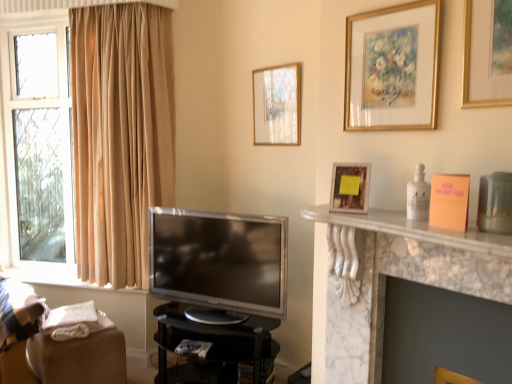
Locate an element on the screen. The image size is (512, 384). gold-framed painting at upper center, positioned as the third picture frame in back-to-front order is located at coordinates (392, 68).

In order to face satin silver television at center, should I rotate leftwards or rightwards?

Turn left approximately 5.817 degrees to face it.

The image size is (512, 384). Find the location of `satin silver television at center`. satin silver television at center is located at coordinates (219, 260).

Where is `white marble fireplace at right`? The width and height of the screenshot is (512, 384). white marble fireplace at right is located at coordinates (396, 277).

Could you tell me if satin silver television at center is turned towards brown fabric swivel chair at lower left?

No, satin silver television at center is not facing towards brown fabric swivel chair at lower left.

Considering the relative sizes of satin silver television at center and brown fabric swivel chair at lower left in the image provided, is satin silver television at center bigger than brown fabric swivel chair at lower left?

Correct, satin silver television at center is larger in size than brown fabric swivel chair at lower left.

Can you confirm if satin silver television at center is positioned to the right of brown fabric swivel chair at lower left?

Indeed, satin silver television at center is positioned on the right side of brown fabric swivel chair at lower left.

How many degrees apart are the facing directions of satin silver television at center and brown fabric swivel chair at lower left?

satin silver television at center and brown fabric swivel chair at lower left are facing 59.4 degrees away from each other.

Does black glossy tv stand at lower center have a lesser width compared to matte gold picture frame at upper center, which ranks as the first picture frame in back-to-front order?

Incorrect, the width of black glossy tv stand at lower center is not less than that of matte gold picture frame at upper center, which ranks as the first picture frame in back-to-front order.

Is black glossy tv stand at lower center not close to matte gold picture frame at upper center, marked as the 1th picture frame in a left-to-right arrangement?

Absolutely, black glossy tv stand at lower center is distant from matte gold picture frame at upper center, marked as the 1th picture frame in a left-to-right arrangement.

Based on their sizes in the image, would you say black glossy tv stand at lower center is bigger or smaller than matte gold picture frame at upper center, marked as the 1th picture frame in a left-to-right arrangement?

In the image, black glossy tv stand at lower center appears to be larger than matte gold picture frame at upper center, marked as the 1th picture frame in a left-to-right arrangement.

From a real-world perspective, is black glossy tv stand at lower center under matte gold picture frame at upper center, marked as the 1th picture frame in a left-to-right arrangement?

Correct, in the physical world, black glossy tv stand at lower center is lower than matte gold picture frame at upper center, marked as the 1th picture frame in a left-to-right arrangement.

Does brown fabric swivel chair at lower left have a smaller size compared to white marble fireplace at right?

Yes.

How different are the orientations of brown fabric swivel chair at lower left and white marble fireplace at right in degrees?

81.2 degrees separate the facing orientations of brown fabric swivel chair at lower left and white marble fireplace at right.

Locate an element on the screen. The height and width of the screenshot is (384, 512). shelf above the brown fabric swivel chair at lower left (from a real-world perspective) is located at coordinates (396, 277).

Is brown fabric swivel chair at lower left taller or shorter than white marble fireplace at right?

Considering their sizes, brown fabric swivel chair at lower left has less height than white marble fireplace at right.

Is black glossy tv stand at lower center oriented towards white marble fireplace at right?

No, black glossy tv stand at lower center is not facing towards white marble fireplace at right.

Can you confirm if black glossy tv stand at lower center is taller than white marble fireplace at right?

Incorrect, the height of black glossy tv stand at lower center is not larger of that of white marble fireplace at right.

From the image's perspective, is black glossy tv stand at lower center below white marble fireplace at right?

Indeed, from the image's perspective, black glossy tv stand at lower center is shown beneath white marble fireplace at right.

Is white marble fireplace at right beside satin silver television at center?

No.

Does white marble fireplace at right appear on the left side of satin silver television at center?

No.

The width and height of the screenshot is (512, 384). In order to click on television positioned vertically above the white marble fireplace at right (from a real-world perspective) in this screenshot , I will do `click(219, 260)`.

Does white marble fireplace at right come behind satin silver television at center?

No, it is in front of satin silver television at center.

Choose the correct answer: Is brown fabric swivel chair at lower left inside matte gold picture frame at upper center, arranged as the third picture frame when viewed from the right, or outside it?

brown fabric swivel chair at lower left is spatially situated outside matte gold picture frame at upper center, arranged as the third picture frame when viewed from the right.

Is brown fabric swivel chair at lower left facing away from matte gold picture frame at upper center, which ranks as the first picture frame in back-to-front order?

No, brown fabric swivel chair at lower left's orientation is not away from matte gold picture frame at upper center, which ranks as the first picture frame in back-to-front order.

From the image's perspective, is brown fabric swivel chair at lower left below matte gold picture frame at upper center, which ranks as the first picture frame in back-to-front order?

Correct, brown fabric swivel chair at lower left appears lower than matte gold picture frame at upper center, which ranks as the first picture frame in back-to-front order, in the image.

Can you tell me how much brown fabric swivel chair at lower left and matte gold picture frame at upper center, marked as the 1th picture frame in a left-to-right arrangement, differ in facing direction?

They differ by 81.6 degrees in their facing directions.

Could you measure the distance between brown fabric swivel chair at lower left and gold-framed painting at upper center, positioned as the third picture frame in back-to-front order?

A distance of 6.50 feet exists between brown fabric swivel chair at lower left and gold-framed painting at upper center, positioned as the third picture frame in back-to-front order.

Could you tell me if brown fabric swivel chair at lower left is turned towards gold-framed painting at upper center, positioned as the third picture frame in back-to-front order?

No, brown fabric swivel chair at lower left is not facing towards gold-framed painting at upper center, positioned as the third picture frame in back-to-front order.

From a real-world perspective, which is physically below, brown fabric swivel chair at lower left or gold-framed painting at upper center, positioned as the 1th picture frame in front-to-back order?

From a 3D spatial view, brown fabric swivel chair at lower left is below.

Is brown fabric swivel chair at lower left touching gold-framed painting at upper center, which appears as the third picture frame when viewed from the left?

brown fabric swivel chair at lower left is not next to gold-framed painting at upper center, which appears as the third picture frame when viewed from the left, and they're not touching.

This screenshot has width=512, height=384. In order to click on swivel chair that is on the left side of satin silver television at center in this screenshot , I will do `click(52, 345)`.

The image size is (512, 384). Identify the location of furniture in front of the matte gold picture frame at upper center, which ranks as the first picture frame in back-to-front order. (214, 348).

Estimate the real-world distances between objects in this image. Which object is closer to white marble fireplace at right, white marble fireplace at right or wooden photo frame at upper right, arranged as the 2th picture frame when viewed from the right?

white marble fireplace at right is closer to white marble fireplace at right.

When comparing their distances from satin silver television at center, does wooden photo frame at upper right, marked as the second picture frame in a left-to-right arrangement, or white marble fireplace at right seem closer?

white marble fireplace at right is closer to satin silver television at center.

Looking at the image, which one is located closer to brown fabric swivel chair at lower left, white marble fireplace at right or satin silver television at center?

satin silver television at center is closer to brown fabric swivel chair at lower left.

Which object lies further to the anchor point gold-framed painting at upper center, positioned as the 1th picture frame in front-to-back order, black glossy tv stand at lower center or white marble fireplace at right?

black glossy tv stand at lower center is positioned further to the anchor gold-framed painting at upper center, positioned as the 1th picture frame in front-to-back order.

Considering their positions, is white marble fireplace at right positioned further to matte plastic book at lower center than satin silver television at center?

Based on the image, white marble fireplace at right appears to be further to matte plastic book at lower center.

From the image, which object appears to be farther from white marble fireplace at right, white marble fireplace at right or black glossy tv stand at lower center?

Among the two, black glossy tv stand at lower center is located further to white marble fireplace at right.

Considering their positions, is satin silver television at center positioned closer to brown fabric swivel chair at lower left than gold-framed painting at upper center, placed as the first picture frame when sorted from right to left?

satin silver television at center is positioned closer to the anchor brown fabric swivel chair at lower left.

Considering their positions, is white marble fireplace at right positioned closer to satin silver television at center than brown fabric swivel chair at lower left?

brown fabric swivel chair at lower left lies closer to satin silver television at center than the other object.

Find the location of a particular element. Image resolution: width=512 pixels, height=384 pixels. furniture located between brown fabric swivel chair at lower left and white marble fireplace at right in the left-right direction is located at coordinates (214, 348).

Find the location of a particular element. This screenshot has width=512, height=384. television between white marble fireplace at right and matte plastic book at lower center in the front-back direction is located at coordinates (219, 260).

At what (x,y) coordinates should I click in order to perform the action: click on furniture located between brown fabric swivel chair at lower left and wooden photo frame at upper right, arranged as the 2th picture frame when viewed from the right, in the left-right direction. Please return your answer as a coordinate pair (x, y). Looking at the image, I should click on (214, 348).

You are a GUI agent. You are given a task and a screenshot of the screen. Output one action in this format:
    pyautogui.click(x=<x>, y=<y>)
    Task: Click on the furniture between white marble fireplace at right and matte plastic book at lower center in the front-back direction
    Image resolution: width=512 pixels, height=384 pixels.
    Given the screenshot: What is the action you would take?
    pyautogui.click(x=214, y=348)